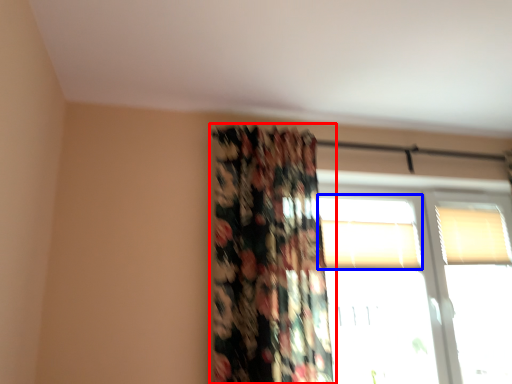
Question: Which object appears farthest to the camera in this image, curtain (highlighted by a red box) or window (highlighted by a blue box)?

Choices:
 (A) curtain
 (B) window

Answer: (B)